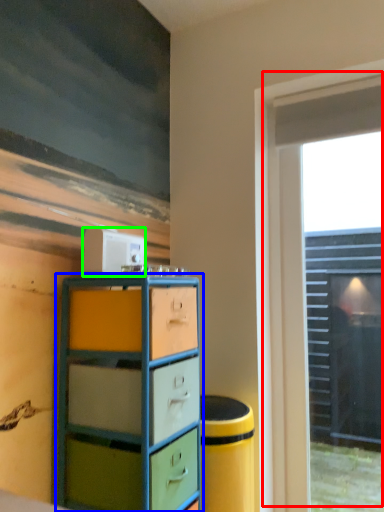
Question: Which is nearer to the window (highlighted by a red box)? chest of drawers (highlighted by a blue box) or appliance (highlighted by a green box).

Choices:
 (A) chest of drawers
 (B) appliance

Answer: (A)